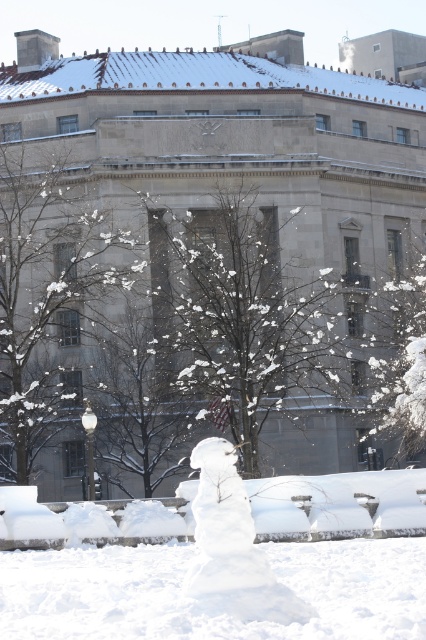
You are a photographer planning to take a picture of the beige stone building at center and the snowy bare tree at center from the front. Which object will appear larger in the photo?

The beige stone building at center will appear larger in the photo because it is much taller than the snowy bare tree at center.

You are standing in front of the beige stone building at center and the white fluffy snowman at center. Which object is positioned higher in the image?

The beige stone building at center is located above the white fluffy snowman at center, so it is positioned higher in the image.